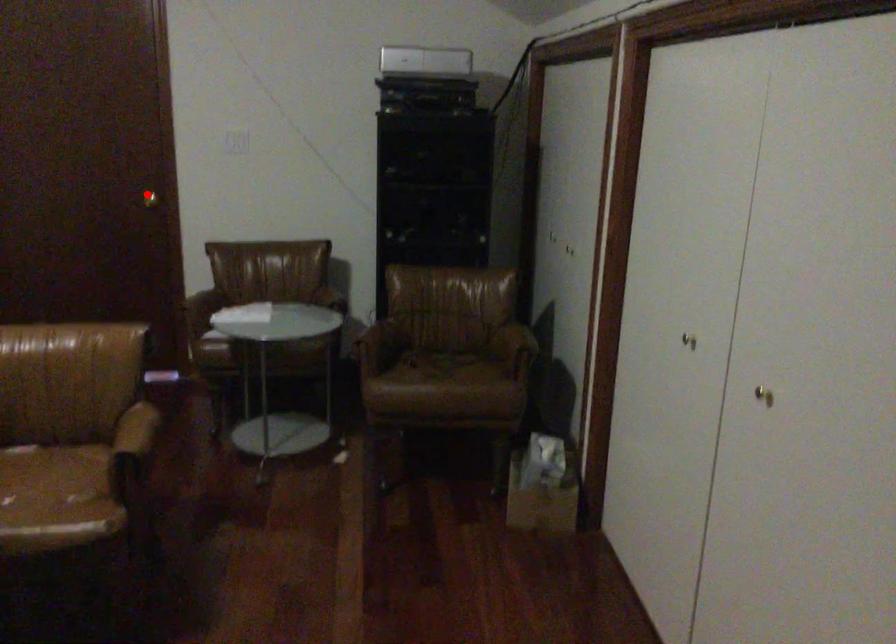
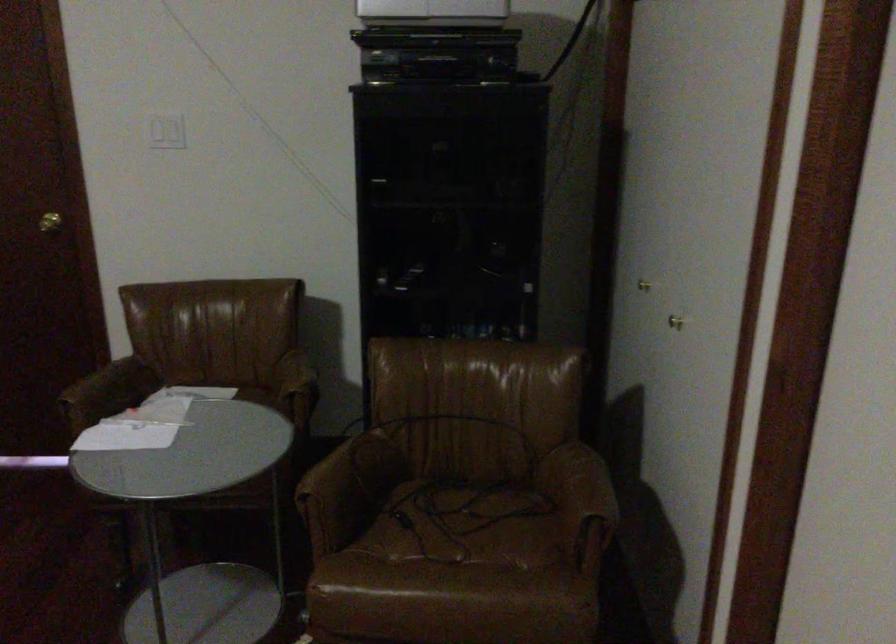
Where in the second image is the point corresponding to the highlighted location from the first image?

(49, 222)